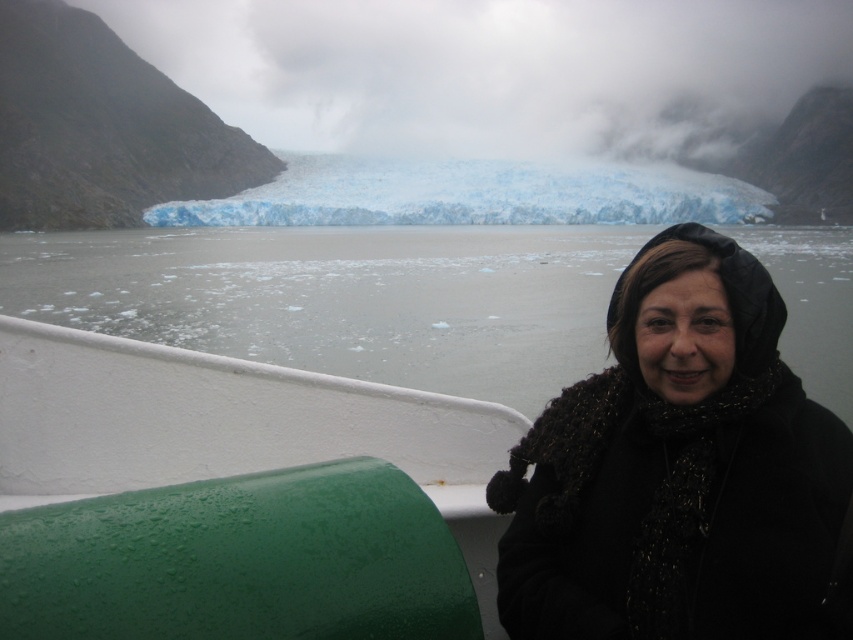
You are a photographer trying to capture the blue ice glacier at center from the boat. There is a green rubber tube at lower left on the boat. To avoid the tube blocking the glacier in your shot, which direction should you move the camera?

Move the camera to the right to avoid the green rubber tube at lower left blocking the blue ice glacier at center since the tube is to the left of the glacier.

You are standing on the boat and want to grab the green rubber tube at lower left to secure it before the boat moves. Considering your arm length is 2.5 meters, can you reach it without moving your feet?

The green rubber tube at lower left is 16.31 feet away from viewer. Since 16.31 feet is approximately 5 meters, which is longer than your arm length of 2.5 meters, you cannot reach the green rubber tube at lower left without moving your feet.